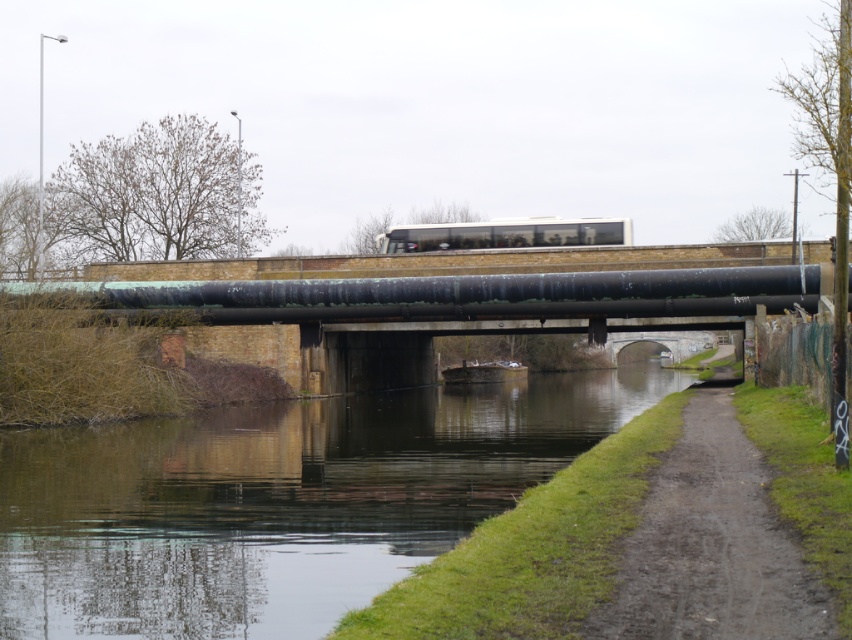
You are a photographer planning to take a photo of the green patina pipe at center and the white glass passenger train at center. Since you want both subjects to be clearly visible in the frame, which object should you prioritize positioning closer to the camera to ensure it doesn

The green patina pipe at center occupies less space than the white glass passenger train at center, so you should position the white glass passenger train at center closer to the camera to ensure it is visible alongside the smaller pipe.

You are standing on the bridge and see the green patina pipe at center and the white glass passenger train at center. Which object is closer to you from your current position?

The green patina pipe at center is closer to you because it is in front of the white glass passenger train at center from your perspective on the bridge.

You are a photographer planning to capture a shot of the green grassy river at lower left and the green patina pipe at center. Which object appears taller in the image?

The green patina pipe at center is taller than the green grassy river at lower left.